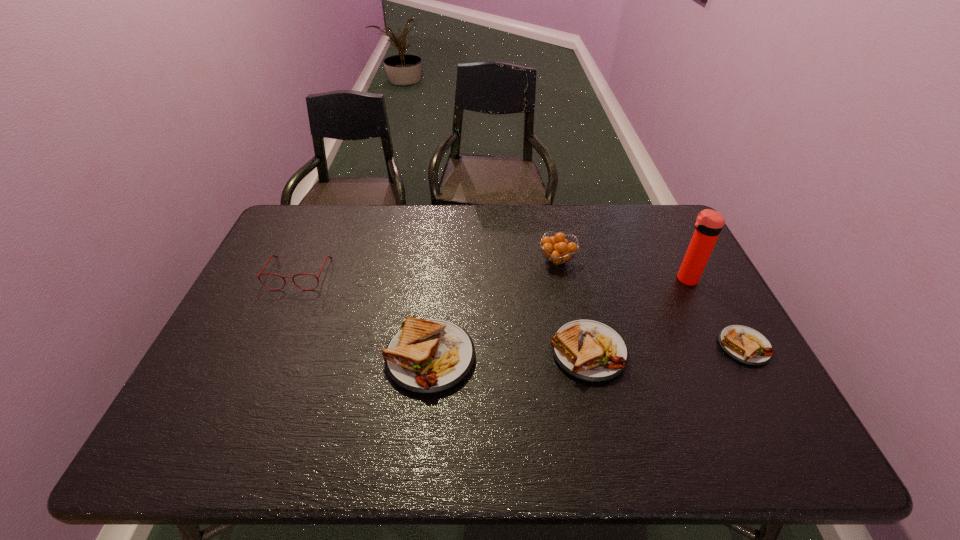
This screenshot has width=960, height=540. I want to click on vacant area at the right edge of the desktop, so click(729, 321).

In the image, there is a desktop. Find the location of `free region at the far left corner`. free region at the far left corner is located at coordinates (295, 239).

This screenshot has width=960, height=540. Identify the location of vacant position at the far right corner of the desktop. (660, 214).

What are the coordinates of `free spot between the tallest object and the leftmost object` in the screenshot? It's located at (492, 276).

At what (x,y) coordinates should I click in order to perform the action: click on vacant point located between the leftmost sandwich and the orange fruit. Please return your answer as a coordinate pair (x, y). This screenshot has height=540, width=960. Looking at the image, I should click on (493, 308).

This screenshot has width=960, height=540. What are the coordinates of `vacant space that's between the thermos bottle and the second shortest object` in the screenshot? It's located at (637, 315).

Identify the location of free point between the second tallest sandwich and the tallest object. Image resolution: width=960 pixels, height=540 pixels. (637, 315).

Locate an element on the screen. vacant space that's between the second tallest sandwich and the rightmost sandwich is located at coordinates (666, 349).

Locate an element on the screen. This screenshot has width=960, height=540. unoccupied position between the tallest object and the shortest sandwich is located at coordinates (715, 313).

Image resolution: width=960 pixels, height=540 pixels. Find the location of `free space between the second shortest object and the fifth object from right to left`. free space between the second shortest object and the fifth object from right to left is located at coordinates click(509, 354).